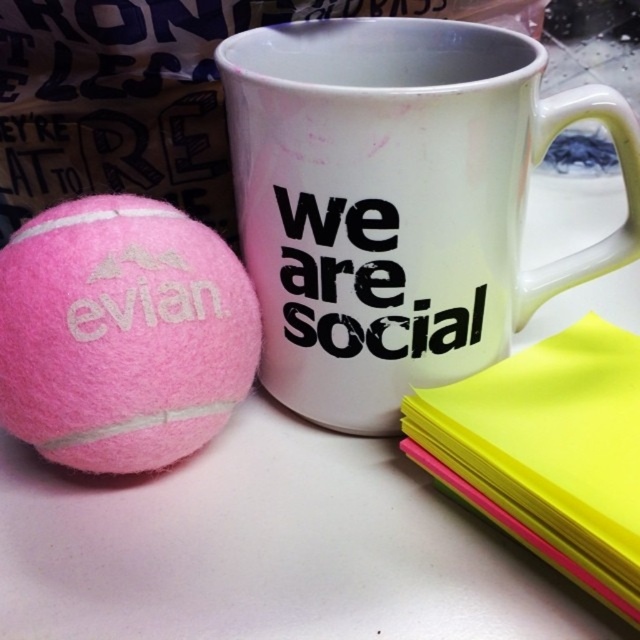
You are taking a photo of the workspace and want to ensure both the point at (426, 76) and the point at (573, 440) are in focus. Which point should you focus on first to capture both clearly?

You should focus on point (426, 76) first because it is closer to the camera than point (573, 440). By focusing on the closer point, the depth of field may extend to include the farther point as well, ensuring both are sharp in the photo.

You are organizing your desk and need to place a small decorative item between the white glossy mug at center and the yellow paper at right. Considering their sizes, which object should you place closer to the smaller one to maintain balance?

The white glossy mug at center is larger than the yellow paper at right. To maintain balance, place the small decorative item closer to the yellow paper at right since it is smaller.

Based on the photo, you are organizing your desk and need to place a new item at the coordinates marked by point (397, 202). What object is currently located at that point?

The point (397, 202) marks the location of the white glossy mug at center.